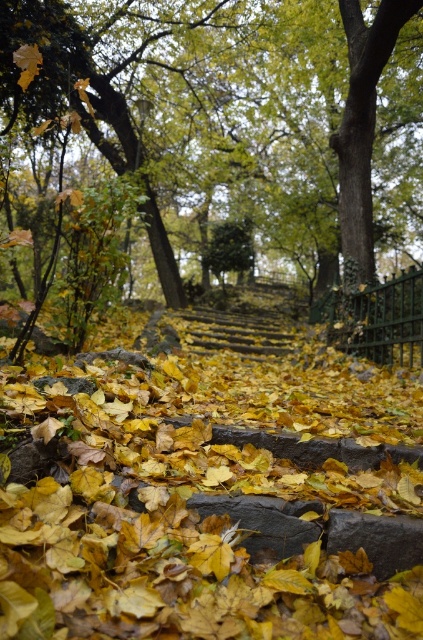
Between yellow leaf litter at center and green leafy tree at center, which one appears on the left side from the viewer's perspective?

From the viewer's perspective, yellow leaf litter at center appears more on the left side.

Is point (211, 369) farther from viewer compared to point (128, 113)?

No, (211, 369) is in front of (128, 113).

You are a GUI agent. You are given a task and a screenshot of the screen. Output one action in this format:
    pyautogui.click(x=<x>, y=<y>)
    Task: Click on the yellow leaf litter at center
    
    Given the screenshot: What is the action you would take?
    pyautogui.click(x=206, y=499)